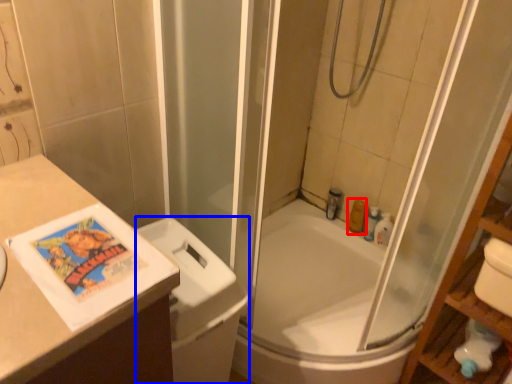
Question: Which of the following is the farthest to the observer, toiletry (highlighted by a red box) or toilet bowl (highlighted by a blue box)?

Choices:
 (A) toiletry
 (B) toilet bowl

Answer: (A)